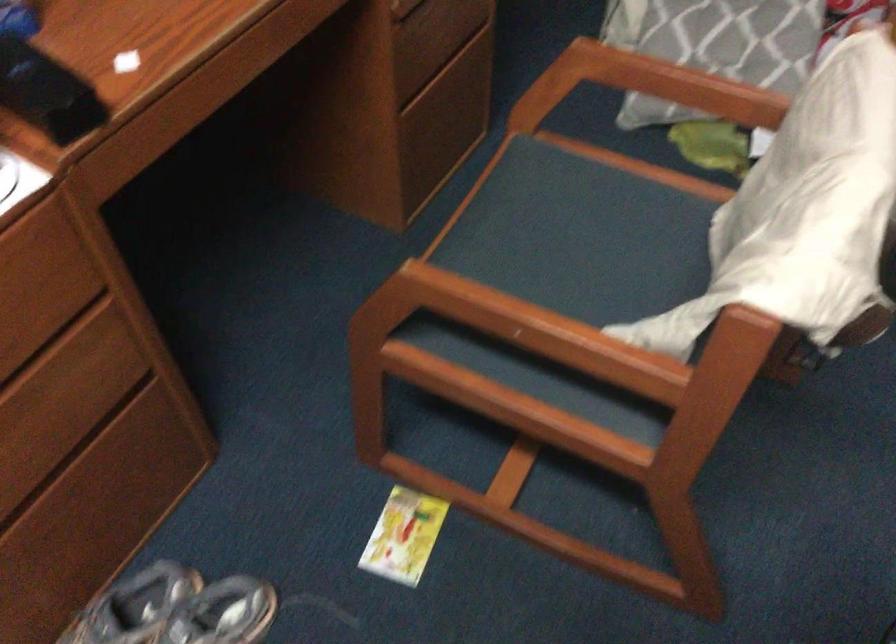
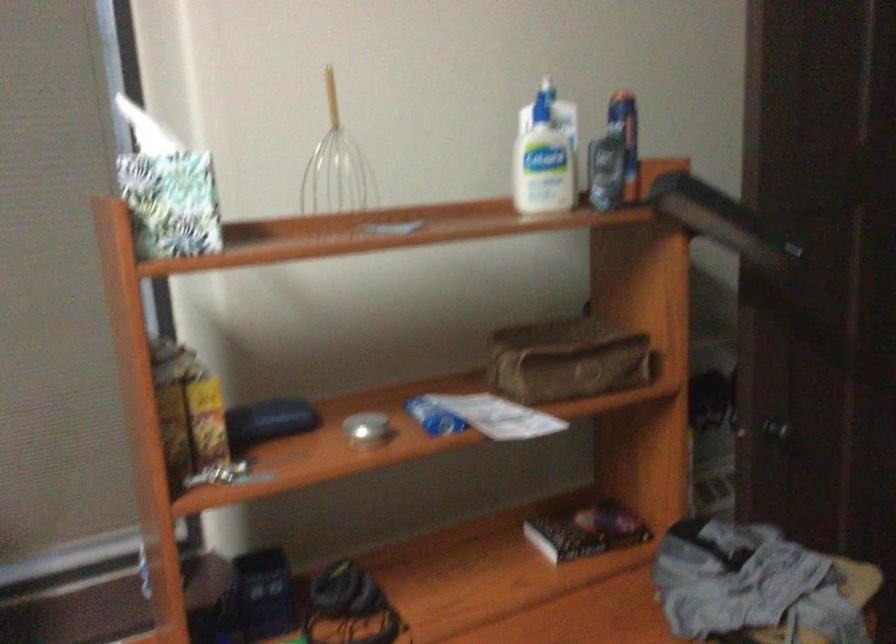
Consider the image. The images are taken continuously from a first-person perspective. In which direction is your viewpoint rotating?

The camera rotated toward left-up.